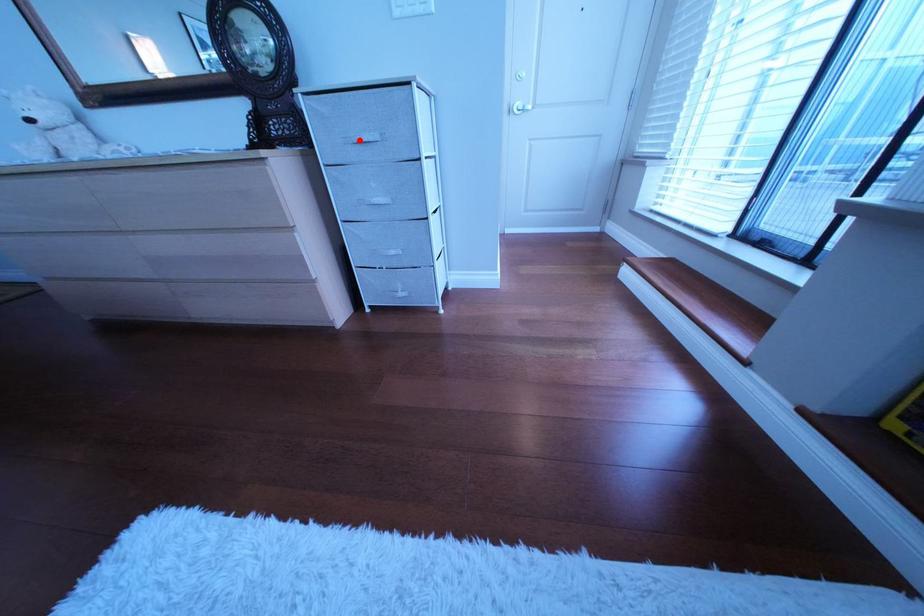
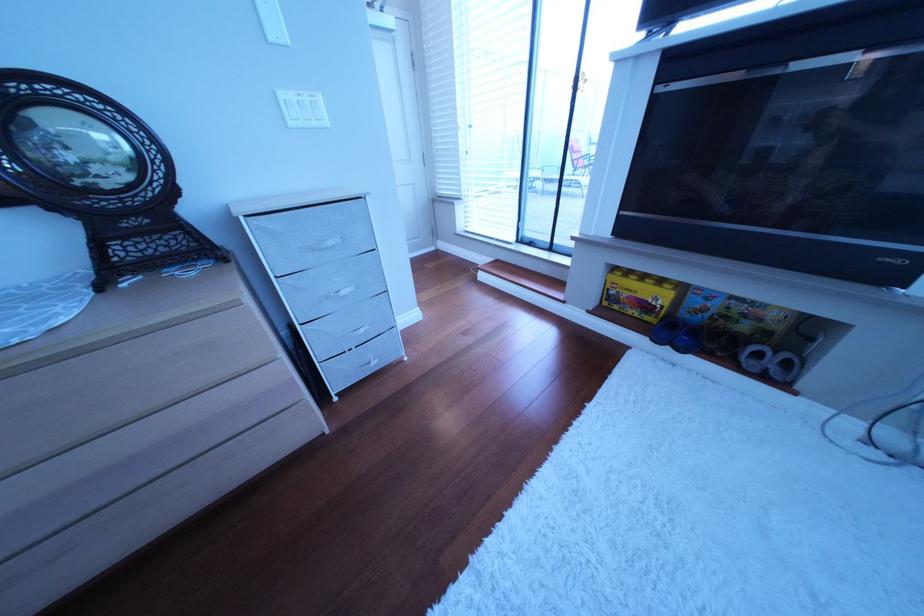
Find the pixel in the second image that matches the highlighted location in the first image.

(317, 249)